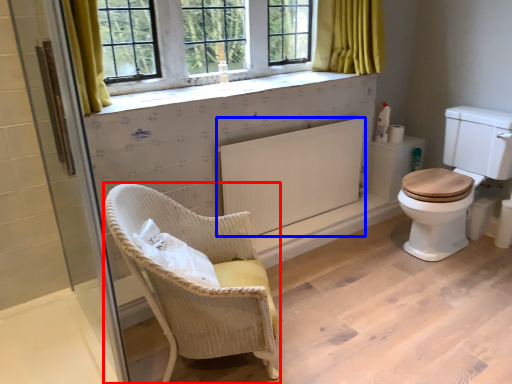
Question: Which object is closer to the camera taking this photo, chair (highlighted by a red box) or radiator (highlighted by a blue box)?

Choices:
 (A) chair
 (B) radiator

Answer: (A)